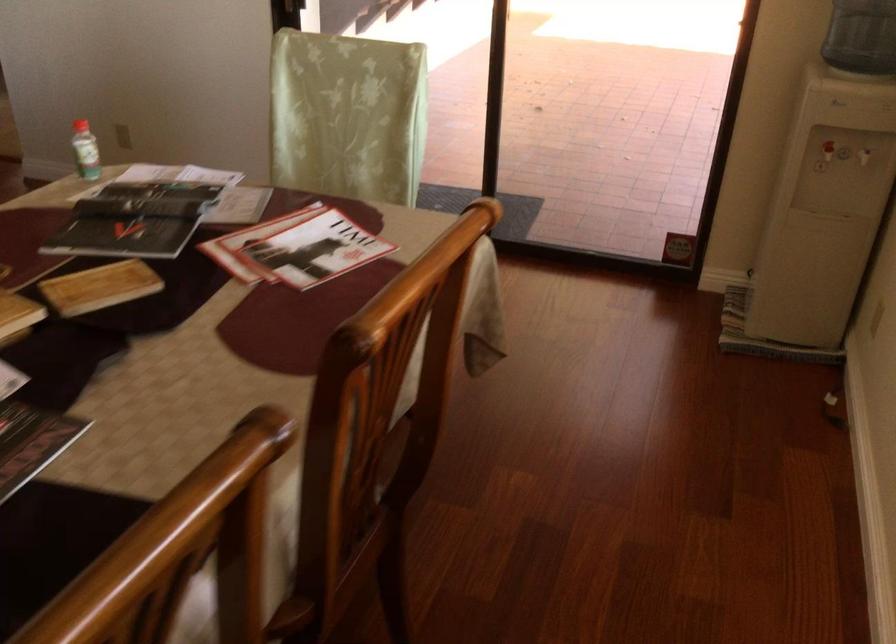
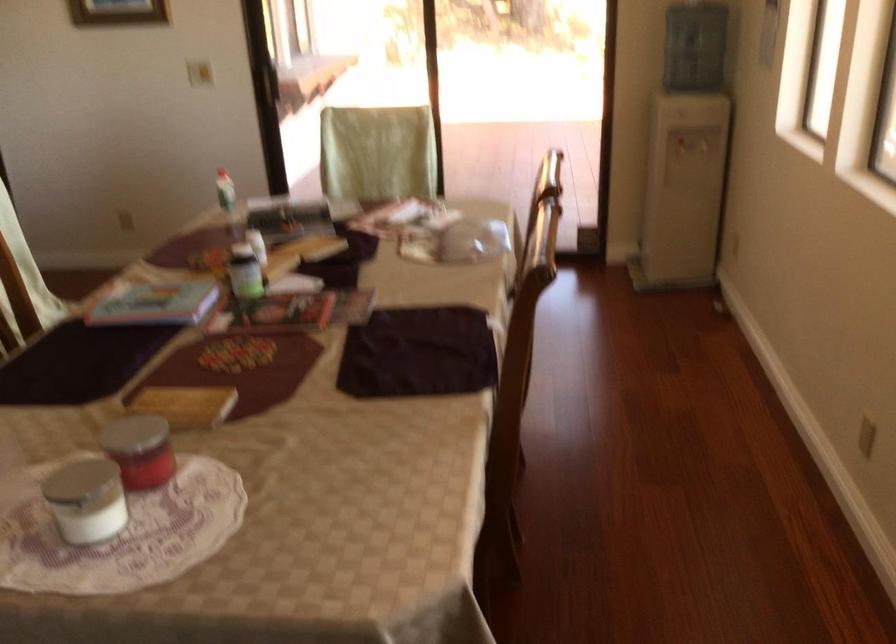
Where in the second image is the point corresponding to [252,237] from the first image?

(366, 218)